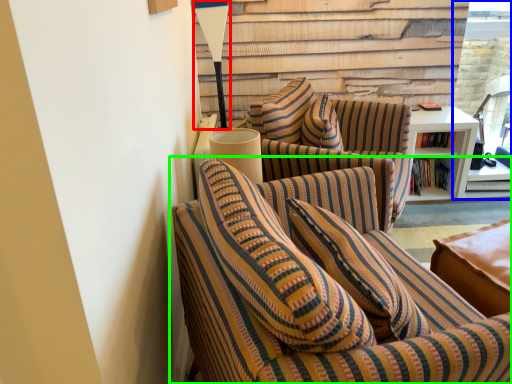
Question: Estimate the real-world distances between objects in this image. Which object is closer to table lamp (highlighted by a red box), glass door (highlighted by a blue box) or studio couch (highlighted by a green box)?

Choices:
 (A) glass door
 (B) studio couch

Answer: (B)